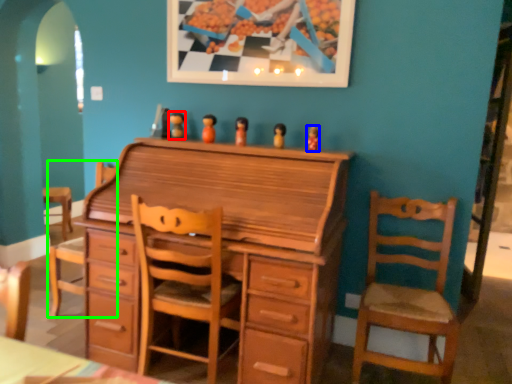
Question: Estimate the real-world distances between objects in this image. Which object is closer to toy (highlighted by a red box), toy (highlighted by a blue box) or swivel chair (highlighted by a green box)?

Choices:
 (A) toy
 (B) swivel chair

Answer: (A)